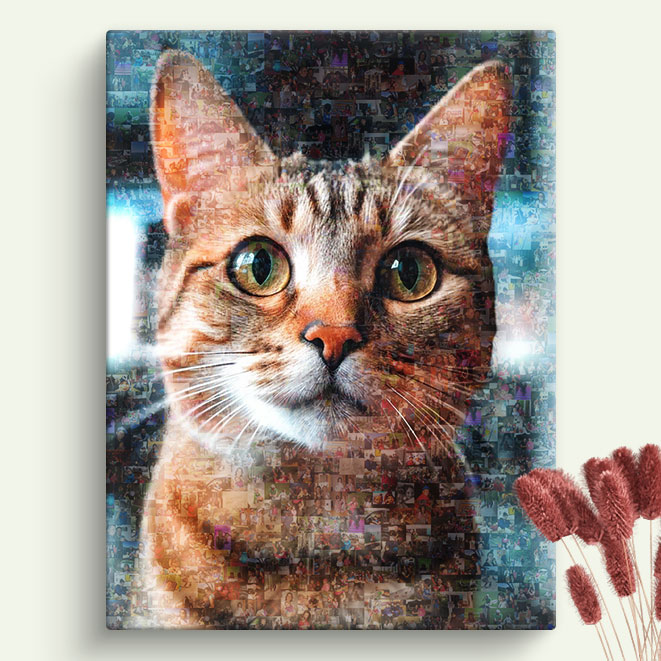
You are a GUI agent. You are given a task and a screenshot of the screen. Output one action in this format:
    pyautogui.click(x=<x>, y=<y>)
    Task: Click on the dried flowers
    This screenshot has height=661, width=661.
    Given the screenshot: What is the action you would take?
    pyautogui.click(x=587, y=596), pyautogui.click(x=541, y=506), pyautogui.click(x=551, y=488), pyautogui.click(x=576, y=488), pyautogui.click(x=619, y=562), pyautogui.click(x=615, y=511), pyautogui.click(x=595, y=465), pyautogui.click(x=631, y=461), pyautogui.click(x=648, y=477), pyautogui.click(x=658, y=562)